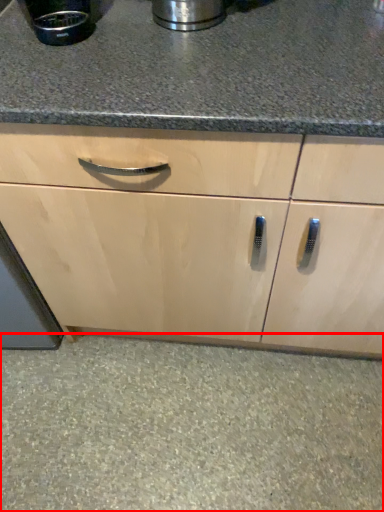
Question: Where is granite (annotated by the red box) located in relation to appliance in the image?

Choices:
 (A) right
 (B) left

Answer: (A)